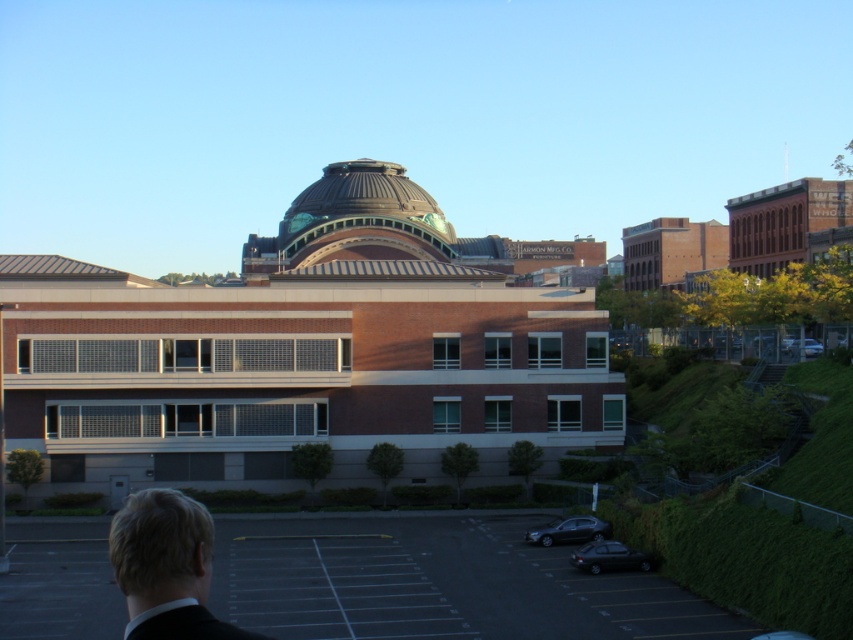
You are standing in the parking lot and see the gold metallic dome at center and the dark brown suit at lower left. Which object is located to the right of the other?

The gold metallic dome at center is positioned on the left side of dark brown suit at lower left, so the dark brown suit at lower left is to the right of the gold metallic dome at center.

You are standing in front of the building and see the matte black suit at lower left and the shiny black sedan at lower right. Which object is nearer to you?

The matte black suit at lower left is closer to the viewer than the shiny black sedan at lower right.